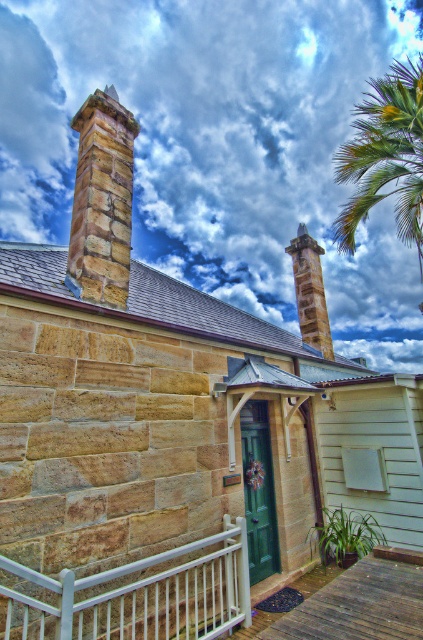
Question: Which object is closer to the camera taking this photo?

Choices:
 (A) green leafy palm tree at upper right
 (B) white fluffy cloud at upper center

Answer: (A)

Question: Does brown stone chimney at upper left appear on the right side of green leafy palm tree at upper right?

Choices:
 (A) yes
 (B) no

Answer: (B)

Question: Which of these objects is positioned closest to the brown stone chimney at center?

Choices:
 (A) white metal rail at lower center
 (B) brown stone chimney at upper left
 (C) green leafy palm tree at upper right
 (D) white fluffy cloud at upper center

Answer: (B)

Question: Is white metal rail at lower center further to the viewer compared to green leafy palm tree at upper right?

Choices:
 (A) no
 (B) yes

Answer: (A)

Question: Is white metal rail at lower center to the left of brown stone chimney at center from the viewer's perspective?

Choices:
 (A) yes
 (B) no

Answer: (A)

Question: Which object is closer to the camera taking this photo?

Choices:
 (A) brown stone chimney at center
 (B) brown stone chimney at upper left
 (C) white metal rail at lower center
 (D) white fluffy cloud at upper center

Answer: (C)